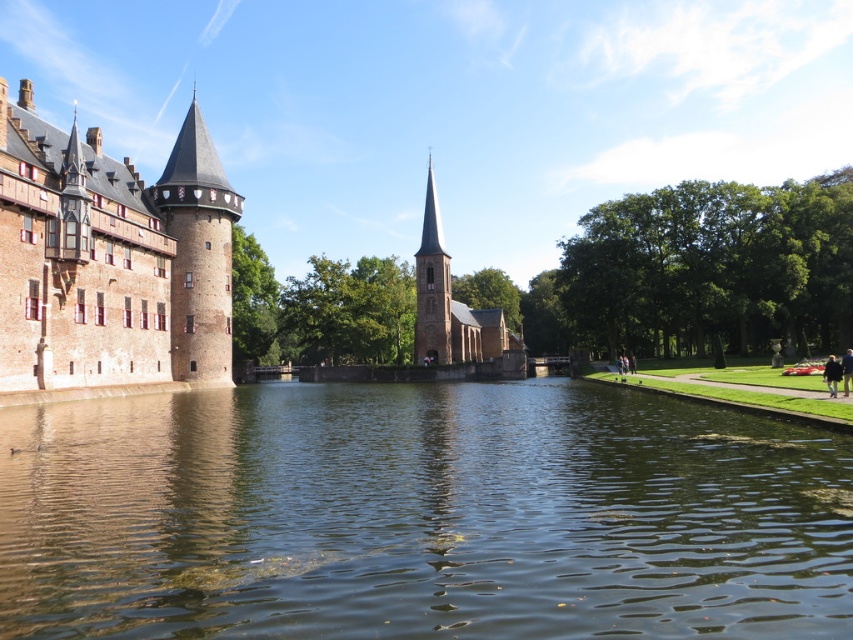
Can you confirm if brick tower at left is positioned below brick stonework tower at left?

Indeed, brick tower at left is positioned under brick stonework tower at left.

Is brick tower at left further to camera compared to brick stonework tower at left?

No.

Image resolution: width=853 pixels, height=640 pixels. What do you see at coordinates (109, 259) in the screenshot? I see `brick tower at left` at bounding box center [109, 259].

I want to click on brick tower at left, so click(x=109, y=259).

Who is higher up, brick tower at left or brown stone tower at center?

brown stone tower at center is above.

Can you confirm if brick tower at left is wider than brown stone tower at center?

Indeed, brick tower at left has a greater width compared to brown stone tower at center.

Is point (38, 362) farther from camera compared to point (434, 209)?

No, it is in front of (434, 209).

Find the location of a particular element. This screenshot has width=853, height=640. brick tower at left is located at coordinates (109, 259).

Based on the photo, does greenish-brown water at center appear over brown stone tower at center?

Incorrect, greenish-brown water at center is not positioned above brown stone tower at center.

From the picture: Is greenish-brown water at center closer to camera compared to brown stone tower at center?

Yes, greenish-brown water at center is in front of brown stone tower at center.

Measure the distance between point (51, 563) and camera.

Point (51, 563) and camera are 116.98 feet apart from each other.

In order to click on greenish-brown water at center in this screenshot , I will do `click(419, 515)`.